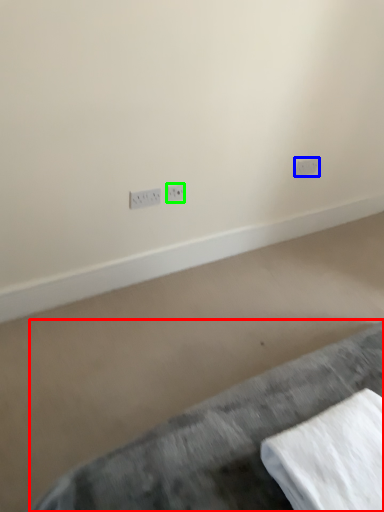
Question: Which is farther away from furniture (highlighted by a red box)? power plugs and sockets (highlighted by a blue box) or power plugs and sockets (highlighted by a green box)?

Choices:
 (A) power plugs and sockets
 (B) power plugs and sockets

Answer: (A)